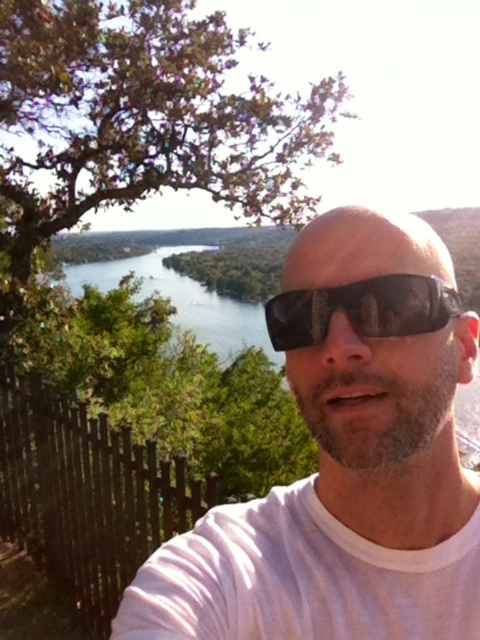
Question: Where is white matte sunglasses at center located in relation to black reflective sunglasses at center in the image?

Choices:
 (A) left
 (B) right

Answer: (A)

Question: Which point appears farthest from the camera in this image?

Choices:
 (A) (396, 292)
 (B) (477, 580)

Answer: (B)

Question: Which object appears farthest from the camera in this image?

Choices:
 (A) white matte sunglasses at center
 (B) black reflective sunglasses at center

Answer: (B)

Question: Observing the image, what is the correct spatial positioning of white matte sunglasses at center in reference to black reflective sunglasses at center?

Choices:
 (A) left
 (B) right

Answer: (A)

Question: Is white matte sunglasses at center smaller than black reflective sunglasses at center?

Choices:
 (A) yes
 (B) no

Answer: (B)